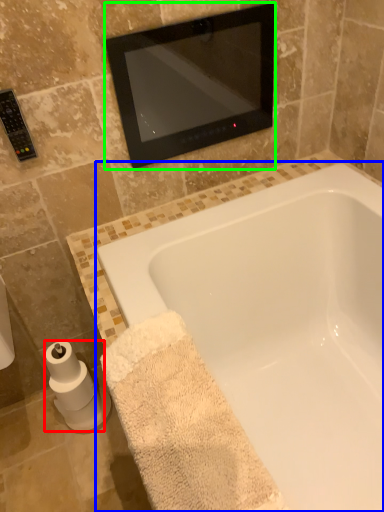
Question: Based on their relative distances, which object is farther from toilet paper (highlighted by a red box)? Choose from bathtub (highlighted by a blue box) and mirror (highlighted by a green box).

Choices:
 (A) bathtub
 (B) mirror

Answer: (B)